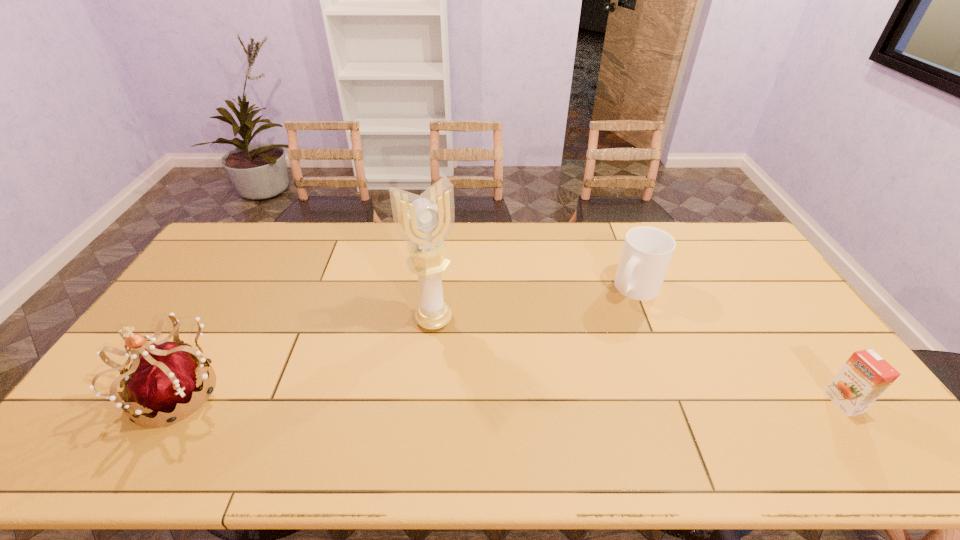
Identify the location of tiara. This screenshot has width=960, height=540. (164, 377).

I want to click on the leftmost object, so click(x=164, y=377).

You are a GUI agent. You are given a task and a screenshot of the screen. Output one action in this format:
    pyautogui.click(x=<x>, y=<y>)
    Task: Click on the rightmost object
    
    Given the screenshot: What is the action you would take?
    pyautogui.click(x=866, y=375)

At what (x,y) coordinates should I click in order to perform the action: click on orange juice. Please return your answer as a coordinate pair (x, y). The height and width of the screenshot is (540, 960). Looking at the image, I should click on click(866, 375).

This screenshot has width=960, height=540. I want to click on the second shortest object, so click(647, 251).

The image size is (960, 540). Identify the location of the third object from left to right. (647, 251).

Where is `the third object from right to left`? the third object from right to left is located at coordinates (424, 221).

Where is `the tallest object`? the tallest object is located at coordinates (424, 221).

You are a GUI agent. You are given a task and a screenshot of the screen. Output one action in this format:
    pyautogui.click(x=<x>, y=<y>)
    Task: Click on the free region located 0.190m on the left of the rightmost object
    This screenshot has width=960, height=540.
    Given the screenshot: What is the action you would take?
    pyautogui.click(x=756, y=402)

This screenshot has height=540, width=960. I want to click on free location located on the handle side of the third object from left to right, so click(x=588, y=366).